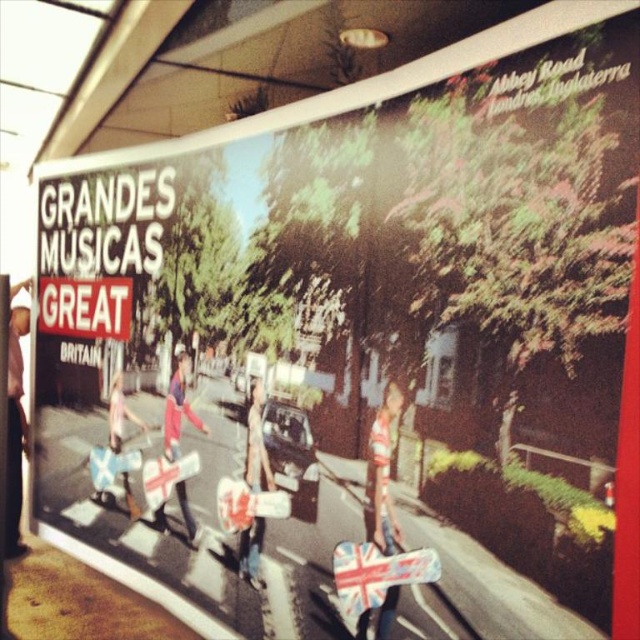
Which is above, denim jacket at center or reddish-pink fabric guitar at center?

reddish-pink fabric guitar at center

Can you confirm if denim jacket at center is taller than reddish-pink fabric guitar at center?

No, denim jacket at center is not taller than reddish-pink fabric guitar at center.

Which is behind, point (241, 557) or point (180, 364)?

Point (180, 364)

The height and width of the screenshot is (640, 640). I want to click on denim jacket at center, so click(x=257, y=444).

Does striped jersey at center appear over reddish-pink fabric guitar at center?

Actually, striped jersey at center is below reddish-pink fabric guitar at center.

Is striped jersey at center further to camera compared to reddish-pink fabric guitar at center?

No, striped jersey at center is closer to the viewer.

Between point (371, 484) and point (176, 410), which one is positioned in front?

Point (371, 484) is in front.

The image size is (640, 640). In order to click on striped jersey at center in this screenshot , I will do `click(381, 476)`.

Between white paper sign at upper left and denim jacket at center, which one is positioned lower?

denim jacket at center is below.

Is white paper sign at upper left in front of denim jacket at center?

No, white paper sign at upper left is behind denim jacket at center.

Where is `white paper sign at upper left`? This screenshot has width=640, height=640. white paper sign at upper left is located at coordinates (84, 307).